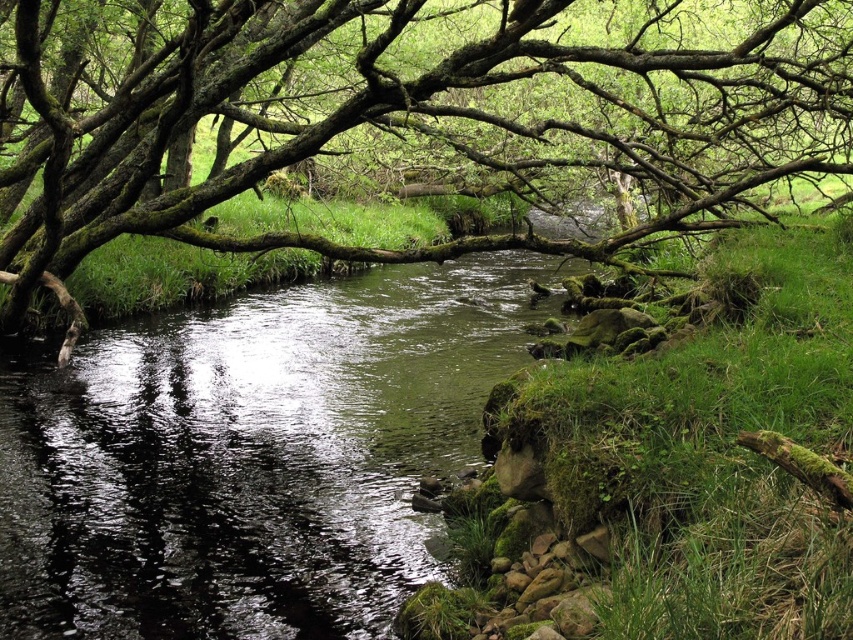
Between green mossy branches at upper center and green mossy water at center, which one is positioned higher?

green mossy branches at upper center is higher up.

Is green mossy branches at upper center smaller than green mossy water at center?

Actually, green mossy branches at upper center might be larger than green mossy water at center.

At what (x,y) coordinates should I click in order to perform the action: click on green mossy branches at upper center. Please return your answer as a coordinate pair (x, y). The image size is (853, 640). Looking at the image, I should click on (413, 113).